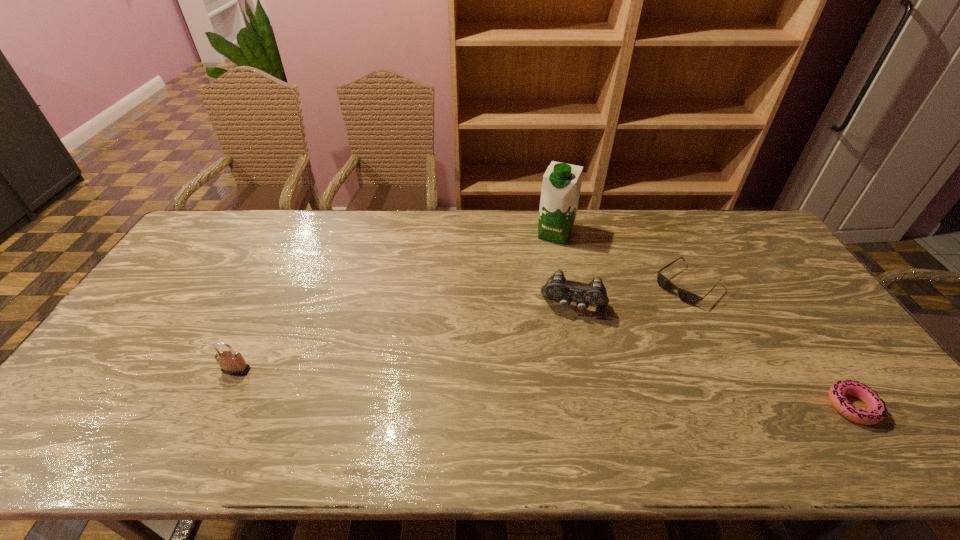
At what (x,y) coordinates should I click in order to perform the action: click on free spot on the desktop that is between the fourth farthest object and the doughnut and is positioned on the lenses of the fourth object from left to right. Please return your answer as a coordinate pair (x, y). Looking at the image, I should click on (562, 389).

The height and width of the screenshot is (540, 960). Find the location of `vacant space on the desktop that is between the padlock and the nearest object and is positioned on the front-facing side of the soya milk`. vacant space on the desktop that is between the padlock and the nearest object and is positioned on the front-facing side of the soya milk is located at coordinates (488, 385).

The height and width of the screenshot is (540, 960). What are the coordinates of `vacant space on the desktop that is between the leftmost object and the nearest object and is positioned on the surface of the control with buttons` in the screenshot? It's located at (562, 389).